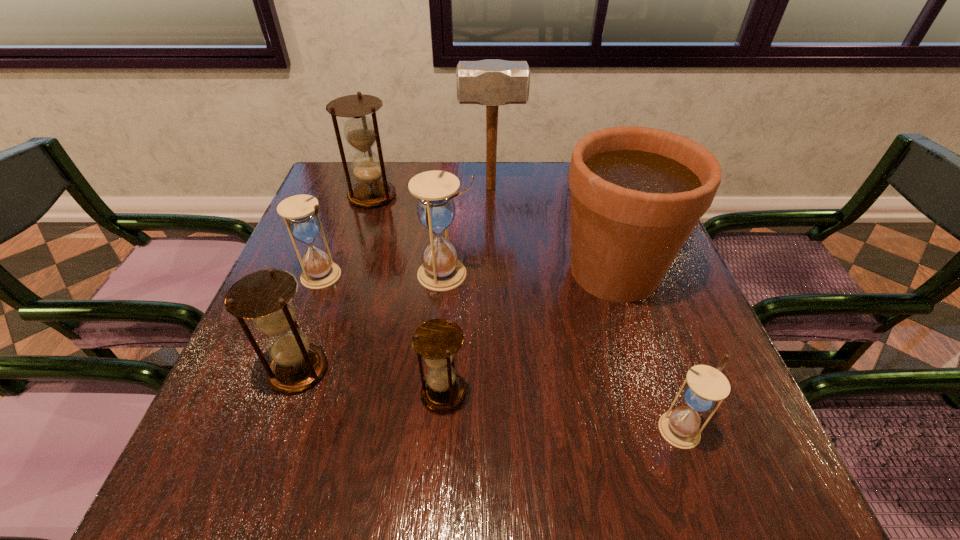
I want to click on vacant area that lies between the rightmost brown hourglass and the flowerpot, so click(529, 332).

The width and height of the screenshot is (960, 540). I want to click on object that can be found as the fourth closest to the flowerpot, so point(437,340).

Where is `the closest object relative to the second biggest white hourglass`? the closest object relative to the second biggest white hourglass is located at coordinates (265, 296).

Choose which hourglass is the nearest neighbor to the rightmost hourglass. Please provide its 2D coordinates. Your answer should be formatted as a tuple, i.e. [(x, y)], where the tuple contains the x and y coordinates of a point satisfying the conditions above.

[(437, 340)]

Locate which hourglass is the fifth closest to the flowerpot. Please provide its 2D coordinates. Your answer should be formatted as a tuple, i.e. [(x, y)], where the tuple contains the x and y coordinates of a point satisfying the conditions above.

[(265, 296)]

Identify which white hourglass is the second closest to the leftmost white hourglass. Please provide its 2D coordinates. Your answer should be formatted as a tuple, i.e. [(x, y)], where the tuple contains the x and y coordinates of a point satisfying the conditions above.

[(706, 386)]

Select which white hourglass is the closest to the farthest hourglass. Please provide its 2D coordinates. Your answer should be formatted as a tuple, i.e. [(x, y)], where the tuple contains the x and y coordinates of a point satisfying the conditions above.

[(300, 212)]

Choose which brown hourglass is the second nearest neighbor to the second biggest brown hourglass. Please provide its 2D coordinates. Your answer should be formatted as a tuple, i.e. [(x, y)], where the tuple contains the x and y coordinates of a point satisfying the conditions above.

[(361, 132)]

Point out which brown hourglass is positioned as the nearest to the rightmost hourglass. Please provide its 2D coordinates. Your answer should be formatted as a tuple, i.e. [(x, y)], where the tuple contains the x and y coordinates of a point satisfying the conditions above.

[(437, 340)]

Locate an element on the screen. This screenshot has width=960, height=540. vacant position in the image that satisfies the following two spatial constraints: 1. on the front side of the nearest white hourglass; 2. on the left side of the flowerpot is located at coordinates (664, 429).